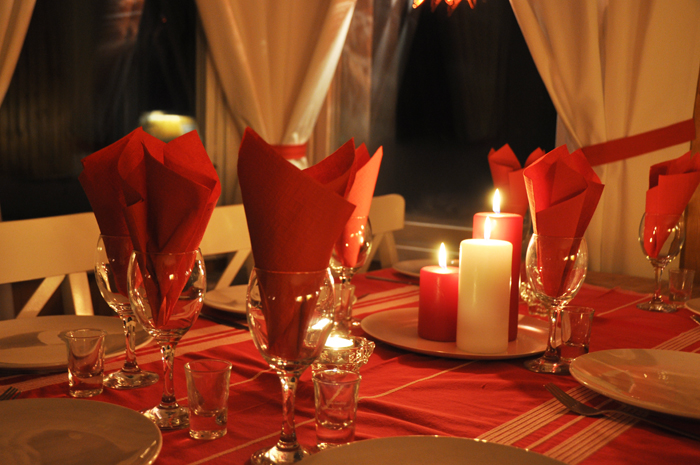
You are a GUI agent. You are given a task and a screenshot of the screen. Output one action in this format:
    pyautogui.click(x=<x>, y=<y>)
    Task: Click on the red napkins
    
    Given the screenshot: What is the action you would take?
    pyautogui.click(x=181, y=213), pyautogui.click(x=299, y=224), pyautogui.click(x=116, y=217), pyautogui.click(x=357, y=181), pyautogui.click(x=511, y=185), pyautogui.click(x=561, y=193), pyautogui.click(x=662, y=197)